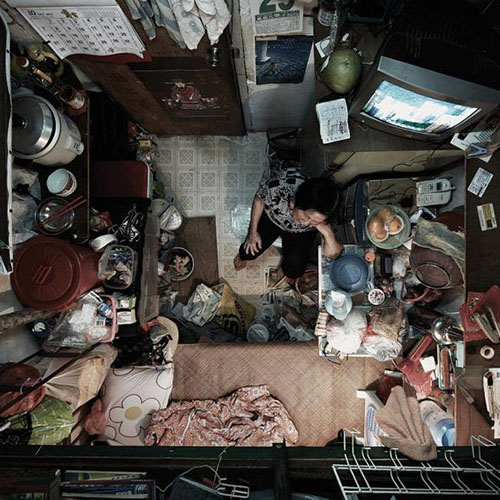
The height and width of the screenshot is (500, 500). I want to click on surface where tv sits, so click(377, 138).